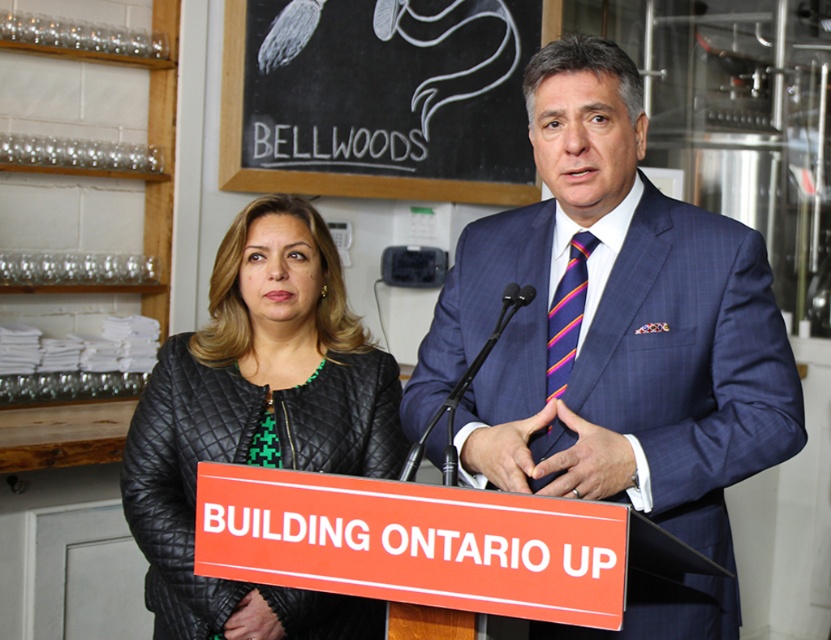
Question: Is black chalkboard at upper center closer to the viewer compared to striped silk tie at center?

Choices:
 (A) yes
 (B) no

Answer: (B)

Question: Which object is the farthest from the striped silk tie at center?

Choices:
 (A) black quilted jacket at center
 (B) orange plastic sign at center
 (C) black chalkboard at upper center

Answer: (C)

Question: Which is farther from the blue textured suit at center?

Choices:
 (A) black chalkboard at upper center
 (B) striped silk tie at center

Answer: (A)

Question: Considering the relative positions of blue textured suit at center and black chalkboard at upper center in the image provided, where is blue textured suit at center located with respect to black chalkboard at upper center?

Choices:
 (A) right
 (B) left

Answer: (A)

Question: Is black quilted jacket at center to the left of black chalkboard at upper center from the viewer's perspective?

Choices:
 (A) no
 (B) yes

Answer: (B)

Question: Which point is closer to the camera?

Choices:
 (A) (239, 40)
 (B) (568, 369)
 (C) (613, 301)

Answer: (C)